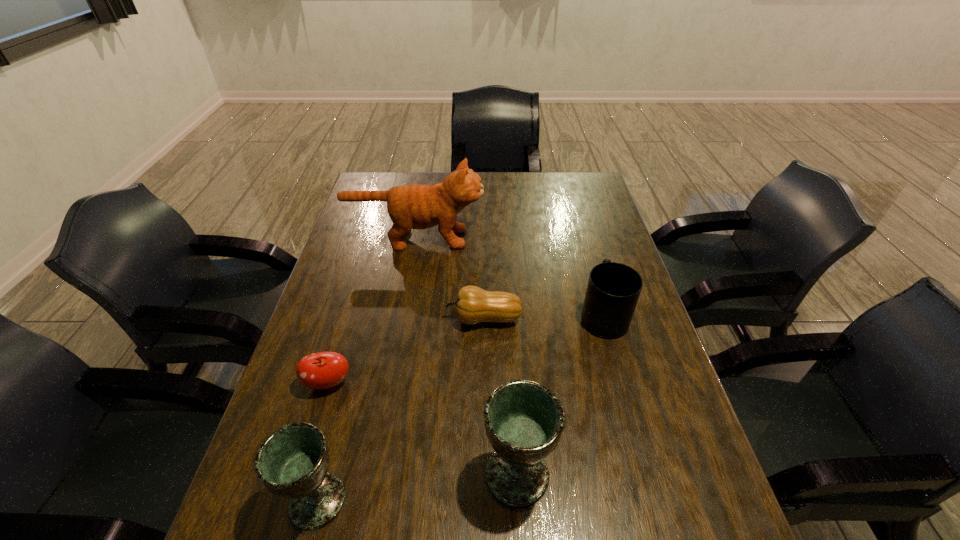
Image resolution: width=960 pixels, height=540 pixels. Identify the location of free location located 0.060m on the right of the left chalice. (378, 500).

You are a GUI agent. You are given a task and a screenshot of the screen. Output one action in this format:
    pyautogui.click(x=<x>, y=<y>)
    Task: Click on the free space located 0.290m on the left of the taller chalice
    
    Given the screenshot: What is the action you would take?
    pyautogui.click(x=339, y=474)

Locate an element on the screen. The width and height of the screenshot is (960, 540). free spot located 0.130m on the face of the cat is located at coordinates tap(522, 239).

Find the location of a particular element. The image size is (960, 540). vacant space located 0.350m on the side of the fourth tallest object with the handle is located at coordinates (577, 224).

This screenshot has width=960, height=540. What are the coordinates of `vacant space situated 0.220m on the side of the fourth tallest object with the handle` in the screenshot? It's located at (584, 247).

The height and width of the screenshot is (540, 960). Find the location of `free location located on the side of the fourth tallest object with the handle`. free location located on the side of the fourth tallest object with the handle is located at coordinates (591, 274).

Where is `free spot located on the back of the fourth farthest object`? This screenshot has height=540, width=960. free spot located on the back of the fourth farthest object is located at coordinates point(349,312).

I want to click on free location located 0.110m on the stem side of the gourd, so click(406, 319).

Find the location of a particular element. free location located on the stem side of the gourd is located at coordinates (325, 319).

Locate an element on the screen. The image size is (960, 540). free spot located on the stem side of the gourd is located at coordinates (402, 319).